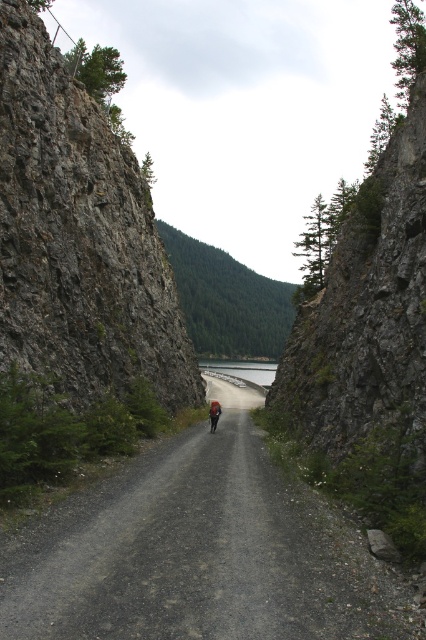
Is point (265, 484) behind point (207, 275)?

No, it is not.

Is dirt/gravel road at center bigger than green forested mountain at center?

Actually, dirt/gravel road at center might be smaller than green forested mountain at center.

This screenshot has height=640, width=426. What are the coordinates of `dirt/gravel road at center` in the screenshot? It's located at click(201, 552).

Which is more to the left, green forested mountain at center or gray concrete dam at center?

From the viewer's perspective, green forested mountain at center appears more on the left side.

Can you confirm if green forested mountain at center is taller than gray concrete dam at center?

Yes, green forested mountain at center is taller than gray concrete dam at center.

Identify the location of green forested mountain at center. Image resolution: width=426 pixels, height=640 pixels. (227, 300).

Is dirt/gravel road at center thinner than gray concrete dam at center?

Indeed, dirt/gravel road at center has a lesser width compared to gray concrete dam at center.

How much distance is there between dirt/gravel road at center and gray concrete dam at center?

They are 175.88 meters apart.

Does point (14, 634) come closer to viewer compared to point (259, 369)?

Yes, point (14, 634) is closer to viewer.

Locate an element on the screen. The width and height of the screenshot is (426, 640). dirt/gravel road at center is located at coordinates (201, 552).